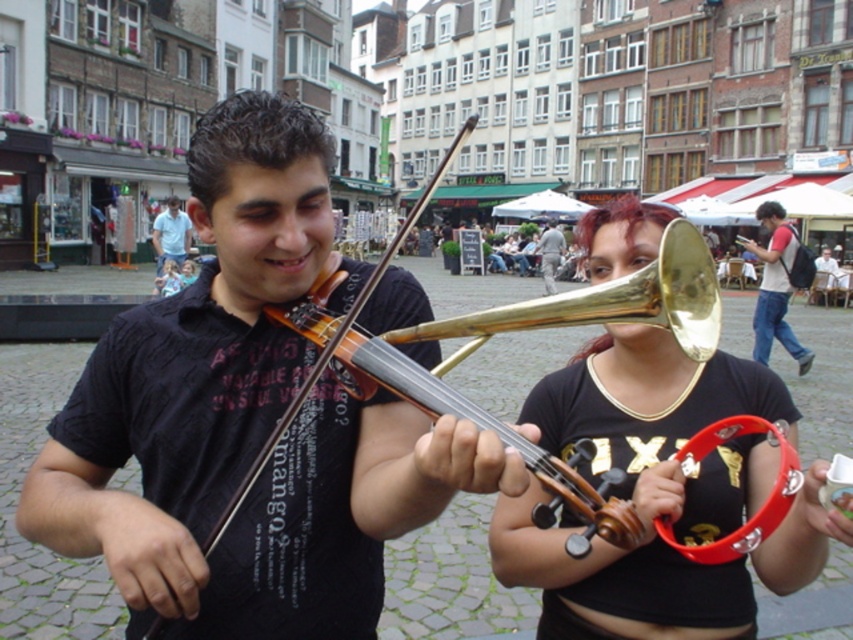
You are a street performer who just finished your set. You see a light blue shirt at center and a white plastic cup at lower right. Which object is closer to the left side of the scene?

The light blue shirt at center is closer to the left side of the scene because it is positioned to the left of the white plastic cup at lower right.

You are a photographer standing in the square and want to capture both the light blue shirt at center and the white plastic cup at lower right in the same frame. Which object should you focus on first to ensure both are in focus?

The light blue shirt at center is larger in size than the white plastic cup at lower right, so you should focus on the light blue shirt at center first to ensure both are in focus.